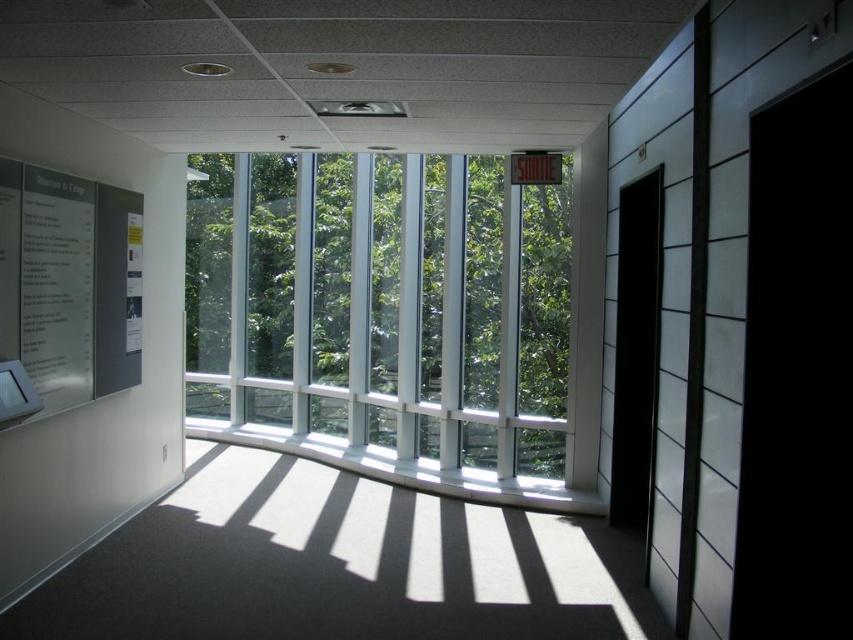
Is transparent glass window at center behind white glossy poster at left?

Yes, it is behind white glossy poster at left.

Is point (361, 179) farther from viewer compared to point (128, 262)?

Yes, it is.

Is point (433, 412) closer to camera compared to point (126, 212)?

No, it is not.

Image resolution: width=853 pixels, height=640 pixels. I want to click on transparent glass window at center, so click(x=383, y=304).

Who is positioned more to the left, matte gray bulletin board at left or white glossy poster at left?

matte gray bulletin board at left is more to the left.

Which is above, matte gray bulletin board at left or white glossy poster at left?

Positioned higher is white glossy poster at left.

Does point (9, 243) come behind point (126, 228)?

No, it is in front of (126, 228).

I want to click on matte gray bulletin board at left, so click(68, 285).

Who is positioned more to the right, transparent glass window at center or matte gray bulletin board at left?

From the viewer's perspective, transparent glass window at center appears more on the right side.

Looking at this image, does transparent glass window at center appear under matte gray bulletin board at left?

Indeed, transparent glass window at center is positioned under matte gray bulletin board at left.

This screenshot has height=640, width=853. Identify the location of transparent glass window at center. (383, 304).

This screenshot has width=853, height=640. Find the location of `transparent glass window at center`. transparent glass window at center is located at coordinates (383, 304).